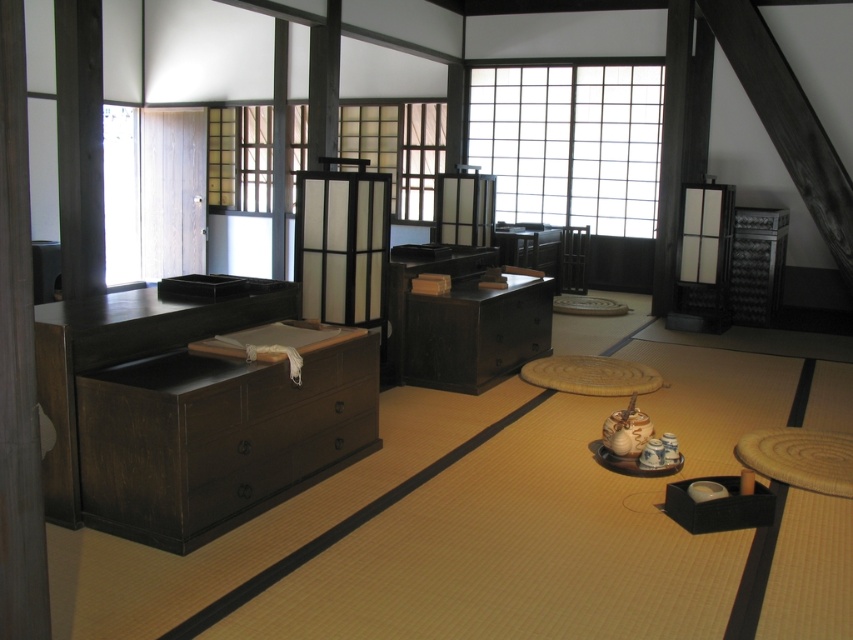
Can you confirm if dark wood dresser at left is taller than dark wood table at center?

Correct, dark wood dresser at left is much taller as dark wood table at center.

Does point (238, 323) lie in front of point (490, 330)?

Yes, point (238, 323) is closer to viewer.

You are a GUI agent. You are given a task and a screenshot of the screen. Output one action in this format:
    pyautogui.click(x=<x>, y=<y>)
    Task: Click on the dark wood dresser at left
    The width and height of the screenshot is (853, 640).
    Given the screenshot: What is the action you would take?
    pyautogui.click(x=190, y=410)